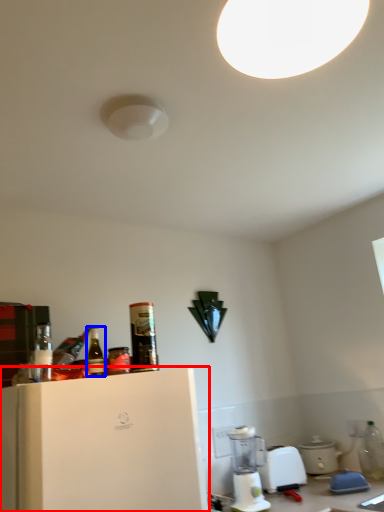
Question: Which point is closer to the camera, home appliance (highlighted by a red box) or bottle (highlighted by a blue box)?

Choices:
 (A) home appliance
 (B) bottle

Answer: (A)